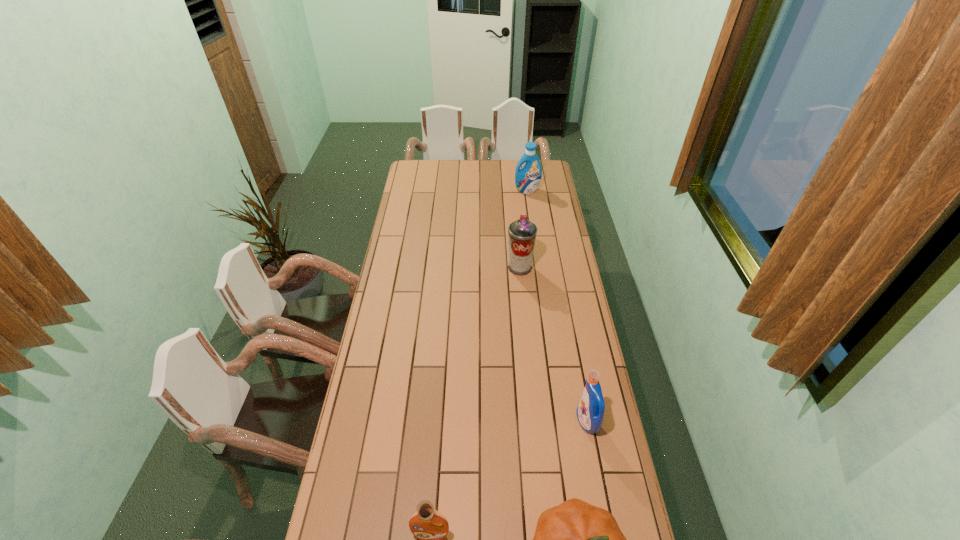
Where is `the fourth nearest object`? The width and height of the screenshot is (960, 540). the fourth nearest object is located at coordinates (522, 233).

At what (x,y) coordinates should I click in order to perform the action: click on the farthest detergent. Please return your answer as a coordinate pair (x, y). Image resolution: width=960 pixels, height=540 pixels. Looking at the image, I should click on (527, 179).

You are a GUI agent. You are given a task and a screenshot of the screen. Output one action in this format:
    pyautogui.click(x=<x>, y=<y>)
    Task: Click on the tallest detergent
    The height and width of the screenshot is (540, 960).
    Given the screenshot: What is the action you would take?
    pyautogui.click(x=527, y=179)

In order to click on the third nearest object in this screenshot , I will do `click(590, 412)`.

This screenshot has height=540, width=960. Identify the location of free space located on the left of the aerosol can. (441, 268).

This screenshot has height=540, width=960. In order to click on free location located 0.350m on the front-facing side of the farthest detergent in this screenshot , I will do click(x=533, y=233).

Where is `vacant area situated on the label of the third farthest object`? The height and width of the screenshot is (540, 960). vacant area situated on the label of the third farthest object is located at coordinates (563, 422).

Identify the location of vacant space located 0.140m on the label of the third farthest object. The image size is (960, 540). (536, 422).

Identify the location of vacant space located on the label of the third farthest object. pyautogui.click(x=476, y=422).

You are a GUI agent. You are given a task and a screenshot of the screen. Output one action in this format:
    pyautogui.click(x=<x>, y=<y>)
    Task: Click on the vacant space at the far edge of the desktop
    
    Given the screenshot: What is the action you would take?
    pyautogui.click(x=475, y=160)